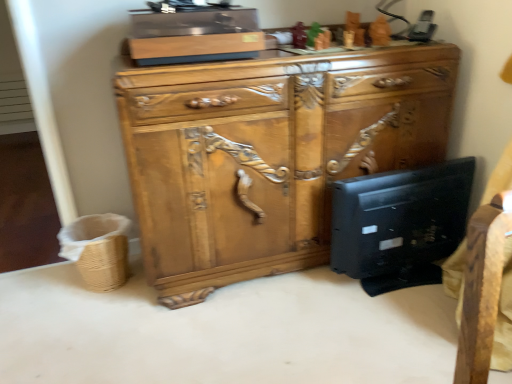
Find the location of `free space in front of black matte desktop computer at lower right`. free space in front of black matte desktop computer at lower right is located at coordinates (389, 334).